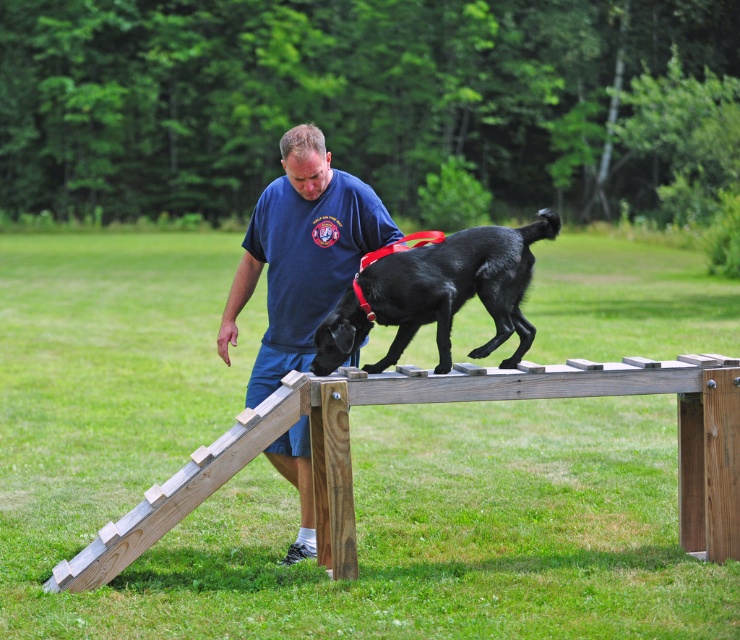
You are a photographer standing to the side of the scene. You want to capture a photo where both the blue cotton shirt at center and the shiny black dog at center are visible in the frame. Given their sizes, which one should you focus on to ensure both are fully in the frame?

The blue cotton shirt at center is taller than the shiny black dog at center. To ensure both are fully in the frame, focus on the blue cotton shirt at center since it is taller and will require more vertical space.